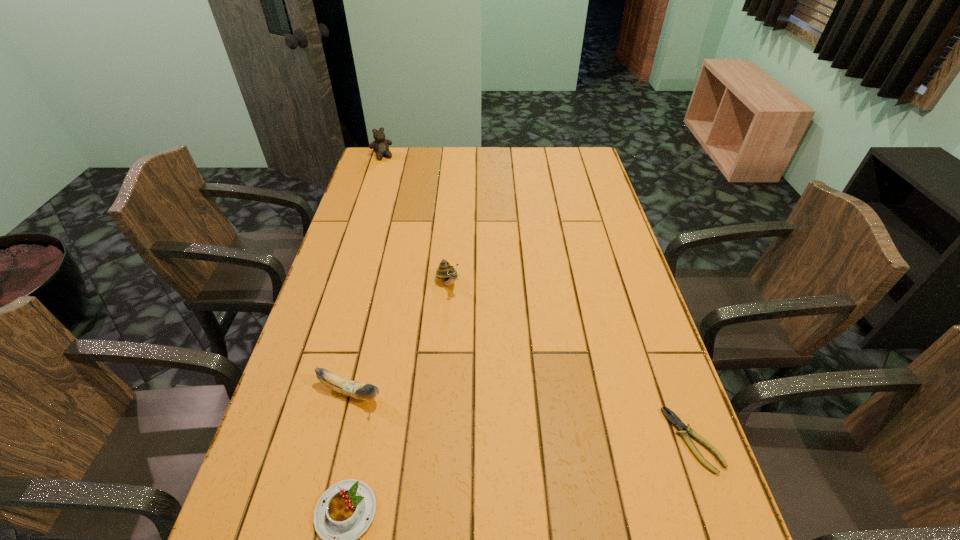
Locate an element on the screen. The height and width of the screenshot is (540, 960). blank space located on the face of the fourth object from left to right is located at coordinates (489, 355).

You are a GUI agent. You are given a task and a screenshot of the screen. Output one action in this format:
    pyautogui.click(x=<x>, y=<y>)
    Task: Click on the free region located 0.300m on the face of the fourth object from left to right
    
    Given the screenshot: What is the action you would take?
    pyautogui.click(x=501, y=376)

At what (x,y) coordinates should I click in order to perform the action: click on vacant region located on the face of the fourth object from left to right. Please return your answer as a coordinate pair (x, y). The image size is (960, 540). Looking at the image, I should click on (482, 343).

Find the location of a particular element. This screenshot has height=540, width=960. vacant space located at the stem of the third shortest object is located at coordinates (492, 442).

Identify the location of vacant area situated 0.140m at the stem of the third shortest object. The width and height of the screenshot is (960, 540). [x=435, y=420].

Identify the location of free region located 0.360m at the stem of the third shortest object. The width and height of the screenshot is (960, 540). (528, 456).

Find the location of `object situated at the far edge`. object situated at the far edge is located at coordinates (380, 145).

You are a GUI agent. You are given a task and a screenshot of the screen. Output one action in this format:
    pyautogui.click(x=<x>, y=<y>)
    Task: Click on the object that is at the near edge
    The image size is (960, 540).
    Given the screenshot: What is the action you would take?
    pyautogui.click(x=676, y=421)

This screenshot has height=540, width=960. Identify the location of teddy bear that is positioned at the left edge. (380, 145).

Find the location of a particular element. This screenshot has height=540, width=960. banana situated at the left edge is located at coordinates (353, 389).